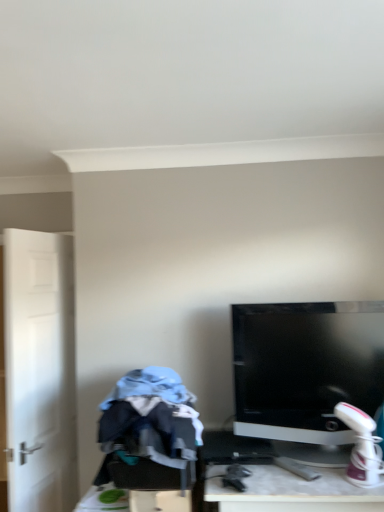
Describe the element at coordinates (306, 373) in the screenshot. I see `satin black monitor at center` at that location.

Describe the element at coordinates (150, 429) in the screenshot. I see `blue cotton hoodie at left` at that location.

The height and width of the screenshot is (512, 384). Find the location of `satin black monitor at center`. satin black monitor at center is located at coordinates (306, 373).

Is blue cotton hoodie at left shorter than satin black monitor at center?

Indeed, blue cotton hoodie at left has a lesser height compared to satin black monitor at center.

Considering the relative sizes of blue cotton hoodie at left and satin black monitor at center in the image provided, is blue cotton hoodie at left bigger than satin black monitor at center?

No, blue cotton hoodie at left is not bigger than satin black monitor at center.

Could you tell me if blue cotton hoodie at left is facing satin black monitor at center?

No.

Choose the correct answer: Is blue cotton hoodie at left inside satin black monitor at center or outside it?

The correct answer is: outside.

Considering the sizes of objects satin black monitor at center and blue cotton hoodie at left in the image provided, who is thinner, satin black monitor at center or blue cotton hoodie at left?

With smaller width is satin black monitor at center.

Does satin black monitor at center touch blue cotton hoodie at left?

satin black monitor at center and blue cotton hoodie at left are clearly separated.

Is satin black monitor at center looking in the opposite direction of blue cotton hoodie at left?

No, satin black monitor at center is not facing the opposite direction of blue cotton hoodie at left.

How many degrees apart are the facing directions of satin black monitor at center and blue cotton hoodie at left?

→ satin black monitor at center and blue cotton hoodie at left are facing 1.94 degrees away from each other.

Can you tell me how much blue cotton hoodie at left and white matte door at left differ in facing direction?

They differ by 105 degrees in their facing directions.

Is blue cotton hoodie at left far away from white matte door at left?

No, blue cotton hoodie at left is in close proximity to white matte door at left.

Consider the image. Is the depth of blue cotton hoodie at left greater than that of white matte door at left?

No, blue cotton hoodie at left is in front of white matte door at left.

How distant is blue cotton hoodie at left from white matte door at left?

The distance of blue cotton hoodie at left from white matte door at left is 26.96 inches.

Between white matte door at left and blue cotton hoodie at left, which one has smaller size?

With smaller size is blue cotton hoodie at left.

Considering the sizes of objects white matte door at left and blue cotton hoodie at left in the image provided, who is wider, white matte door at left or blue cotton hoodie at left?

blue cotton hoodie at left is wider.

Which is more to the left, white matte door at left or blue cotton hoodie at left?

Positioned to the left is white matte door at left.

What's the angular difference between satin black monitor at center and white matte door at left's facing directions?

103 degrees.

Is white matte door at left located within satin black monitor at center?

No, white matte door at left is not inside satin black monitor at center.

From the image's perspective, which is below, satin black monitor at center or white matte door at left?

From the image's view, white matte door at left is below.

Is satin black monitor at center aimed at white matte door at left?

No.

Considering the positions of objects white matte door at left and satin black monitor at center in the image provided, who is in front, white matte door at left or satin black monitor at center?

satin black monitor at center is in front.

Consider the image. Is there a large distance between white matte door at left and satin black monitor at center?

white matte door at left is positioned a significant distance from satin black monitor at center.

From a real-world perspective, does white matte door at left sit lower than satin black monitor at center?

Indeed, from a real-world perspective, white matte door at left is positioned beneath satin black monitor at center.

From the picture: Considering the relative positions of white matte door at left and satin black monitor at center in the image provided, is white matte door at left to the left of satin black monitor at center from the viewer's perspective?

Indeed, white matte door at left is positioned on the left side of satin black monitor at center.

The width and height of the screenshot is (384, 512). I want to click on computer monitor behind the blue cotton hoodie at left, so pyautogui.click(x=306, y=373).

Where is `clothing in front of the satin black monitor at center`? This screenshot has height=512, width=384. clothing in front of the satin black monitor at center is located at coordinates (150, 429).

Looking at the image, which one is located closer to white matte door at left, satin black monitor at center or blue cotton hoodie at left?

Based on the image, blue cotton hoodie at left appears to be nearer to white matte door at left.

Estimate the real-world distances between objects in this image. Which object is closer to blue cotton hoodie at left, satin black monitor at center or white matte door at left?

satin black monitor at center lies closer to blue cotton hoodie at left than the other object.

Based on their spatial positions, is blue cotton hoodie at left or white matte door at left further from satin black monitor at center?

white matte door at left is positioned further to the anchor satin black monitor at center.

Which object lies nearer to the anchor point white matte door at left, blue cotton hoodie at left or satin black monitor at center?

Based on the image, blue cotton hoodie at left appears to be nearer to white matte door at left.

Which object lies further to the anchor point satin black monitor at center, white matte door at left or blue cotton hoodie at left?

white matte door at left.

Estimate the real-world distances between objects in this image. Which object is further from blue cotton hoodie at left, white matte door at left or satin black monitor at center?

Based on the image, white matte door at left appears to be further to blue cotton hoodie at left.

You are a GUI agent. You are given a task and a screenshot of the screen. Output one action in this format:
    pyautogui.click(x=<x>, y=<y>)
    Task: Click on the clothing between white matte door at left and satin black monitor at center in the horizontal direction
    This screenshot has width=384, height=512.
    Given the screenshot: What is the action you would take?
    pyautogui.click(x=150, y=429)